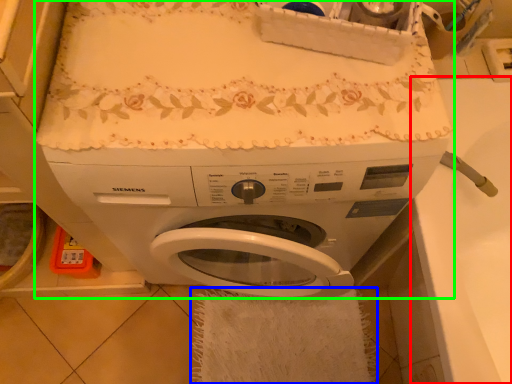
Question: Considering the real-world distances, which object is closest to counter top (highlighted by a red box)? bath towel (highlighted by a blue box) or washing machine (highlighted by a green box).

Choices:
 (A) bath towel
 (B) washing machine

Answer: (B)